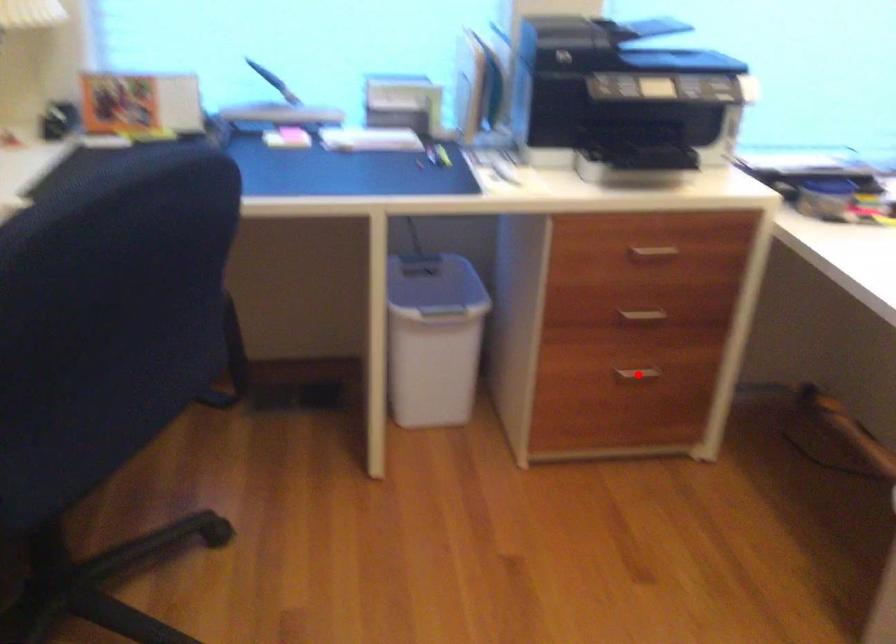
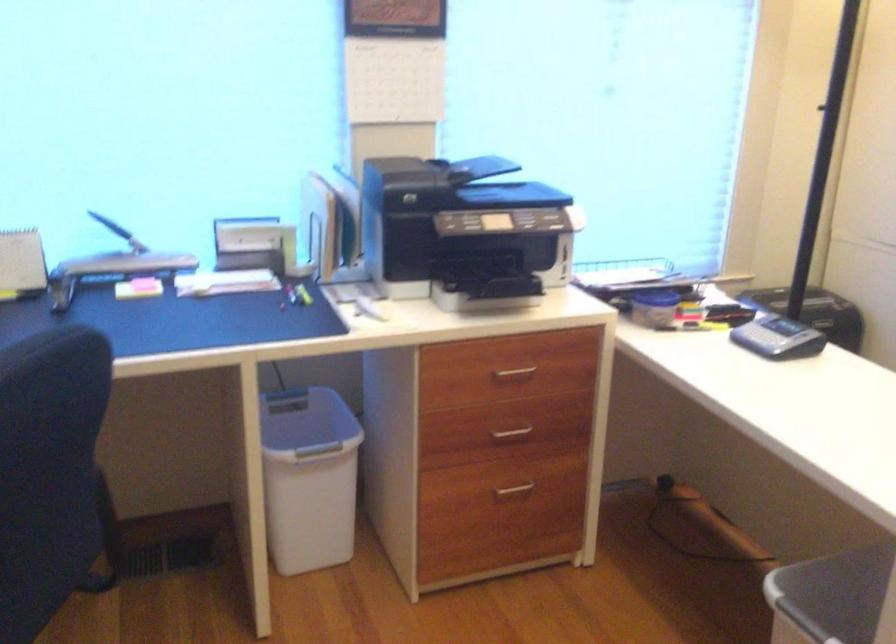
The point at the highlighted location is marked in the first image. Where is the corresponding point in the second image?

(513, 489)